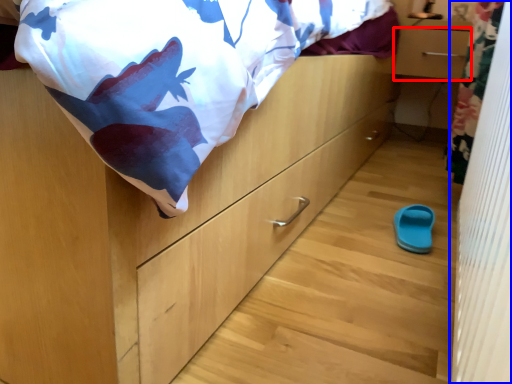
Question: Which object appears closest to the camera in this image, drawer (highlighted by a red box) or curtain (highlighted by a blue box)?

Choices:
 (A) drawer
 (B) curtain

Answer: (B)